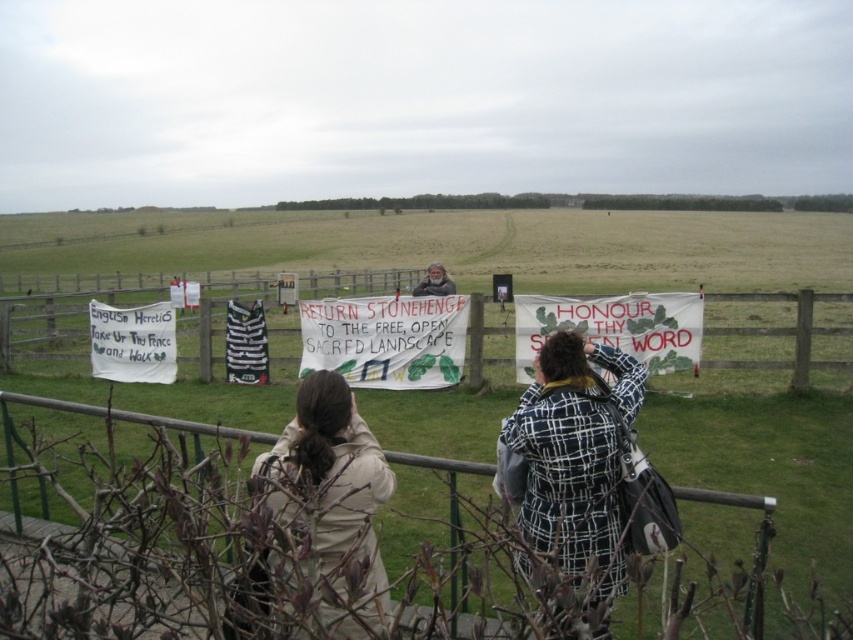
Does point (577, 428) come in front of point (683, 296)?

Yes, point (577, 428) is in front of point (683, 296).

Identify the location of plaid wool coat at center. The image size is (853, 640). (576, 456).

Who is shorter, green metal rail at lower center or light brown wooden sign at center?

With less height is green metal rail at lower center.

Can you confirm if green metal rail at lower center is positioned to the right of light brown wooden sign at center?

Yes, green metal rail at lower center is to the right of light brown wooden sign at center.

The height and width of the screenshot is (640, 853). Identify the location of green metal rail at lower center. (756, 547).

Is green fabric banner at center wider than white paper sign at left?

Correct, the width of green fabric banner at center exceeds that of white paper sign at left.

Does green fabric banner at center appear under white paper sign at left?

Incorrect, green fabric banner at center is not positioned below white paper sign at left.

The image size is (853, 640). What do you see at coordinates (614, 326) in the screenshot?
I see `green fabric banner at center` at bounding box center [614, 326].

The height and width of the screenshot is (640, 853). What are the coordinates of `green fabric banner at center` in the screenshot? It's located at (614, 326).